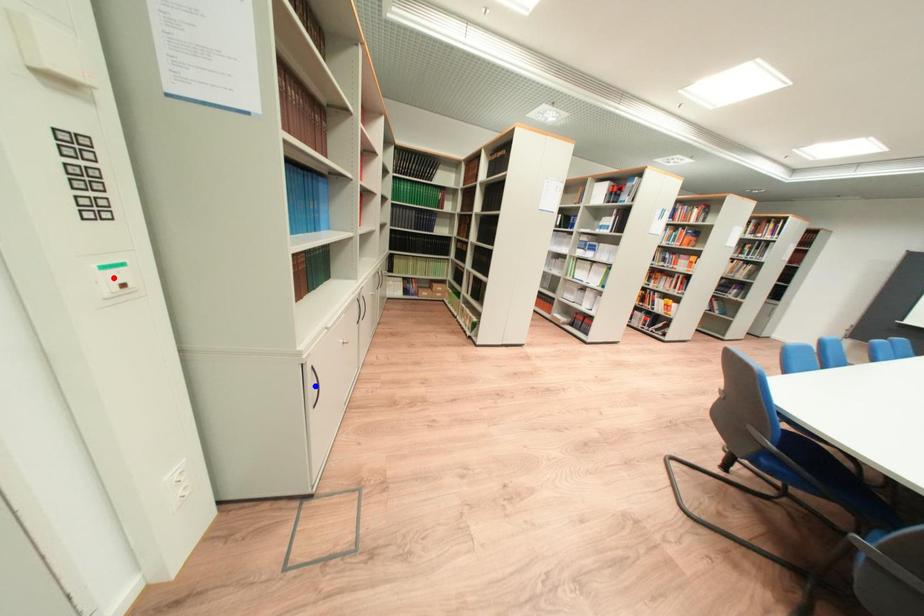
Question: Which of the two points in the image is closer to the camera?

Choices:
 (A) Blue point is closer.
 (B) Red point is closer.

Answer: (B)